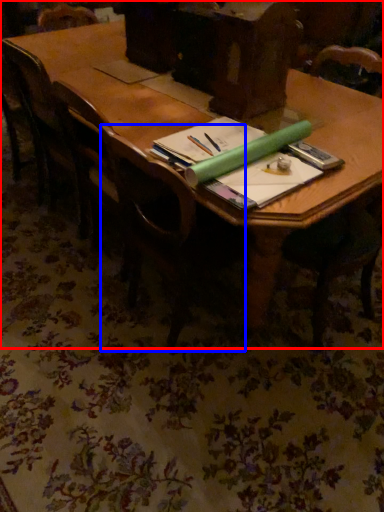
Question: Which of the following is the farthest to the observer, table (highlighted by a red box) or chair (highlighted by a blue box)?

Choices:
 (A) table
 (B) chair

Answer: (B)